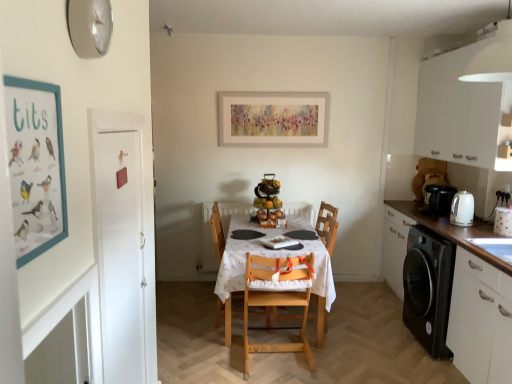
Question: From the image's perspective, is matte cardboard poster at left on silver metallic clock at upper left?

Choices:
 (A) no
 (B) yes

Answer: (A)

Question: Is matte cardboard poster at left oriented away from silver metallic clock at upper left?

Choices:
 (A) no
 (B) yes

Answer: (A)

Question: Is matte cardboard poster at left wider than silver metallic clock at upper left?

Choices:
 (A) yes
 (B) no

Answer: (B)

Question: Is matte cardboard poster at left not inside silver metallic clock at upper left?

Choices:
 (A) yes
 (B) no

Answer: (A)

Question: Is matte cardboard poster at left not close to silver metallic clock at upper left?

Choices:
 (A) no
 (B) yes

Answer: (A)

Question: Considering the relative sizes of matte cardboard poster at left and silver metallic clock at upper left in the image provided, is matte cardboard poster at left taller than silver metallic clock at upper left?

Choices:
 (A) no
 (B) yes

Answer: (B)

Question: Is wooden chair at center, which is counted as the first chair, starting from the back, oriented towards black plastic coffee machine at right?

Choices:
 (A) yes
 (B) no

Answer: (A)

Question: Considering the relative sizes of wooden chair at center, which is counted as the first chair, starting from the back, and black plastic coffee machine at right in the image provided, is wooden chair at center, which is counted as the first chair, starting from the back, smaller than black plastic coffee machine at right?

Choices:
 (A) no
 (B) yes

Answer: (A)

Question: Is black plastic coffee machine at right at the back of wooden chair at center, acting as the second chair starting from the front?

Choices:
 (A) yes
 (B) no

Answer: (B)

Question: Is there a large distance between wooden chair at center, which is counted as the first chair, starting from the back, and black plastic coffee machine at right?

Choices:
 (A) yes
 (B) no

Answer: (A)

Question: From the image's perspective, does wooden chair at center, acting as the second chair starting from the front, appear higher than black plastic coffee machine at right?

Choices:
 (A) no
 (B) yes

Answer: (A)

Question: Is wooden chair at center, which is counted as the first chair, starting from the back, to the right of black plastic coffee machine at right from the viewer's perspective?

Choices:
 (A) no
 (B) yes

Answer: (A)

Question: Considering the relative positions of white matte door at left and white matte cabinet at upper right, which is the 2th cabinetry in bottom-to-top order, in the image provided, is white matte door at left to the right of white matte cabinet at upper right, which is the 2th cabinetry in bottom-to-top order, from the viewer's perspective?

Choices:
 (A) yes
 (B) no

Answer: (B)